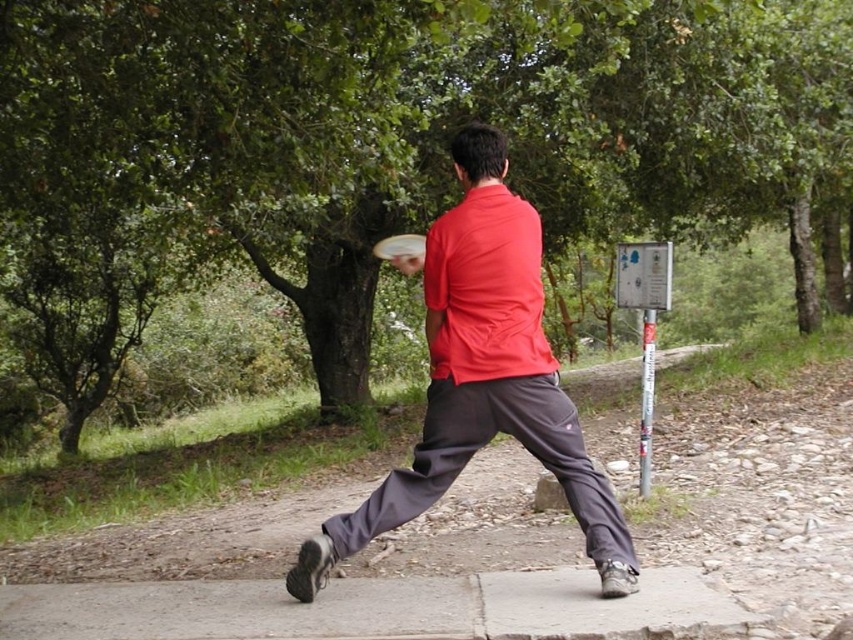
You are planning to take a photo of the green leafy tree at center and the gray concrete pavement at lower center. Which object should you focus on first if you want to capture both in a single shot without moving the camera?

The green leafy tree at center is taller than the gray concrete pavement at lower center, so you should focus on the green leafy tree at center first to ensure it fits within the frame.

You are a person trying to decide where to place your white plastic frisbee at center so it won t roll away. Which surface, the gray concrete pavement at lower center or the grassy area not listed in the objects, would be better to place it on?

The gray concrete pavement at lower center has a larger size compared to white plastic frisbee at center, so placing it on the gray concrete pavement at lower center would provide a stable surface and prevent it from rolling away.